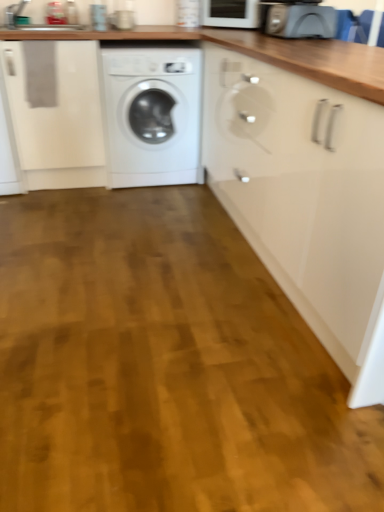
Question: Which direction should I rotate to face white glossy microwave at upper center, positioned as the second appliance in bottom-to-top order, — up or down?

Choices:
 (A) down
 (B) up

Answer: (B)

Question: Is glossy white cabinet at center at the right side of matte gray toaster at upper right, positioned as the second appliance in back-to-front order?

Choices:
 (A) no
 (B) yes

Answer: (A)

Question: From the image's perspective, is glossy white cabinet at center on top of matte gray toaster at upper right, positioned as the second appliance in back-to-front order?

Choices:
 (A) yes
 (B) no

Answer: (B)

Question: Can you confirm if glossy white cabinet at center is wider than matte gray toaster at upper right, marked as the 2th appliance in a top-to-bottom arrangement?

Choices:
 (A) no
 (B) yes

Answer: (B)

Question: Is glossy white cabinet at center closer to camera compared to matte gray toaster at upper right, marked as the first appliance in a front-to-back arrangement?

Choices:
 (A) yes
 (B) no

Answer: (A)

Question: Is glossy white cabinet at center smaller than matte gray toaster at upper right, marked as the first appliance in a front-to-back arrangement?

Choices:
 (A) no
 (B) yes

Answer: (A)

Question: Is matte gray toaster at upper right, which is counted as the first appliance, starting from the bottom, surrounded by glossy white cabinet at center?

Choices:
 (A) yes
 (B) no

Answer: (B)

Question: Is wooden floor at center positioned with its back to white glossy microwave at upper center, positioned as the second appliance in bottom-to-top order?

Choices:
 (A) yes
 (B) no

Answer: (B)

Question: Is white glossy microwave at upper center, the 1th appliance when ordered from top to bottom, located within wooden floor at center?

Choices:
 (A) no
 (B) yes

Answer: (A)

Question: Can you confirm if wooden floor at center is smaller than white glossy microwave at upper center, the 1th appliance when ordered from top to bottom?

Choices:
 (A) no
 (B) yes

Answer: (A)

Question: From a real-world perspective, is wooden floor at center located beneath white glossy microwave at upper center, positioned as the second appliance in bottom-to-top order?

Choices:
 (A) yes
 (B) no

Answer: (A)

Question: Does wooden floor at center have a lesser height compared to white glossy microwave at upper center, positioned as the first appliance in back-to-front order?

Choices:
 (A) yes
 (B) no

Answer: (A)

Question: Are wooden floor at center and white glossy microwave at upper center, the second appliance when ordered from front to back, making contact?

Choices:
 (A) no
 (B) yes

Answer: (A)

Question: From the image's perspective, is white glossy washing machine at center over matte gray toaster at upper right, which is counted as the first appliance, starting from the bottom?

Choices:
 (A) no
 (B) yes

Answer: (A)